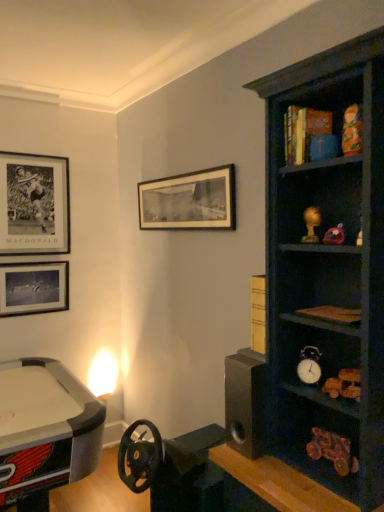
Question: Is metallic silver alarm clock at center-right thinner than multicolored wooden doll at upper right, placed as the 1th toy when sorted from top to bottom?

Choices:
 (A) yes
 (B) no

Answer: (B)

Question: From a real-world perspective, is metallic silver alarm clock at center-right located higher than multicolored wooden doll at upper right, acting as the 2th toy starting from the bottom?

Choices:
 (A) yes
 (B) no

Answer: (B)

Question: Would you say multicolored wooden doll at upper right, acting as the 2th toy starting from the bottom, is part of metallic silver alarm clock at center-right's contents?

Choices:
 (A) yes
 (B) no

Answer: (B)

Question: Could you tell me if metallic silver alarm clock at center-right is facing multicolored wooden doll at upper right, positioned as the 2th toy in back-to-front order?

Choices:
 (A) no
 (B) yes

Answer: (A)

Question: From the image's perspective, is metallic silver alarm clock at center-right located beneath multicolored wooden doll at upper right, positioned as the 2th toy in back-to-front order?

Choices:
 (A) yes
 (B) no

Answer: (A)

Question: Is metallic silver alarm clock at center-right bigger than multicolored wooden doll at upper right, positioned as the 2th toy in back-to-front order?

Choices:
 (A) yes
 (B) no

Answer: (A)

Question: Is matte gold figurine at upper right, the 2th toy from the top, bigger than metallic silver alarm clock at center-right?

Choices:
 (A) no
 (B) yes

Answer: (A)

Question: Is matte gold figurine at upper right, acting as the 1th toy starting from the back, directly adjacent to metallic silver alarm clock at center-right?

Choices:
 (A) yes
 (B) no

Answer: (B)

Question: From a real-world perspective, is matte gold figurine at upper right, placed as the 1th toy when sorted from bottom to top, located higher than metallic silver alarm clock at center-right?

Choices:
 (A) no
 (B) yes

Answer: (B)

Question: Is matte gold figurine at upper right, the 2th toy from the top, thinner than metallic silver alarm clock at center-right?

Choices:
 (A) no
 (B) yes

Answer: (B)

Question: Does matte gold figurine at upper right, placed as the 1th toy when sorted from bottom to top, come in front of metallic silver alarm clock at center-right?

Choices:
 (A) yes
 (B) no

Answer: (B)

Question: Can you confirm if matte gold figurine at upper right, the 2th toy from the top, is smaller than metallic silver alarm clock at center-right?

Choices:
 (A) no
 (B) yes

Answer: (B)

Question: Considering the relative positions of multicolored wooden doll at upper right, which is the first toy in front-to-back order, and matte gold figurine at upper right, placed as the 1th toy when sorted from bottom to top, in the image provided, is multicolored wooden doll at upper right, which is the first toy in front-to-back order, to the right of matte gold figurine at upper right, placed as the 1th toy when sorted from bottom to top, from the viewer's perspective?

Choices:
 (A) no
 (B) yes

Answer: (B)